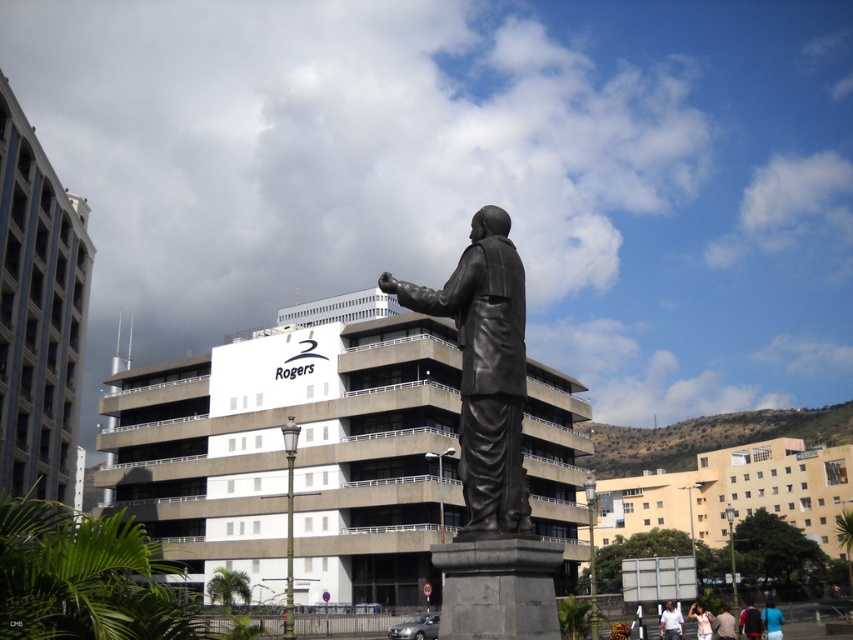
Is blue fabric shirt at lower right shorter than light brown leather jacket at lower right?

In fact, blue fabric shirt at lower right may be taller than light brown leather jacket at lower right.

Is point (764, 628) positioned in front of point (722, 632)?

That is False.

The image size is (853, 640). In order to click on blue fabric shirt at lower right in this screenshot , I will do `click(772, 620)`.

Between blue fabric shirt at lower right and light beige shirt at lower right, which one appears on the right side from the viewer's perspective?

From the viewer's perspective, blue fabric shirt at lower right appears more on the right side.

Between blue fabric shirt at lower right and light beige shirt at lower right, which one is positioned lower?

Positioned lower is blue fabric shirt at lower right.

The height and width of the screenshot is (640, 853). I want to click on blue fabric shirt at lower right, so click(772, 620).

Is bronze statue at center wider than light beige shirt at lower right?

No, bronze statue at center is not wider than light beige shirt at lower right.

Is bronze statue at center further to camera compared to light beige shirt at lower right?

No, it is in front of light beige shirt at lower right.

Describe the element at coordinates (485, 371) in the screenshot. I see `bronze statue at center` at that location.

At what (x,y) coordinates should I click in order to perform the action: click on bronze statue at center. Please return your answer as a coordinate pair (x, y). Image resolution: width=853 pixels, height=640 pixels. Looking at the image, I should click on (485, 371).